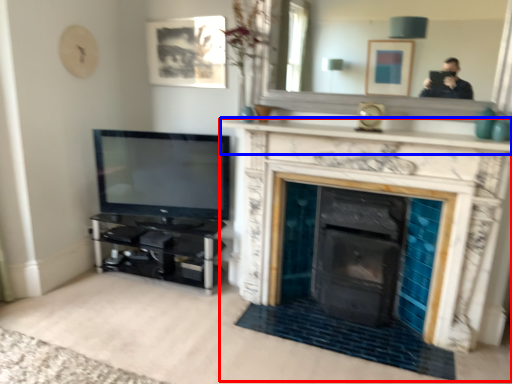
Question: Which object is closer to the camera taking this photo, fireplace (highlighted by a red box) or mantle (highlighted by a blue box)?

Choices:
 (A) fireplace
 (B) mantle

Answer: (A)